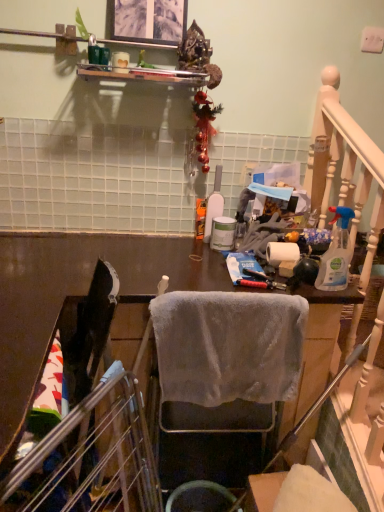
Question: Is clear plastic spray bottle at right, which ranks as the first bottle in right-to-left order, outside of metallic silver picture frame at upper center?

Choices:
 (A) no
 (B) yes

Answer: (B)

Question: From a real-world perspective, does clear plastic spray bottle at right, marked as the second bottle in a back-to-front arrangement, stand above metallic silver picture frame at upper center?

Choices:
 (A) yes
 (B) no

Answer: (B)

Question: Considering the relative sizes of clear plastic spray bottle at right, which ranks as the first bottle in right-to-left order, and metallic silver picture frame at upper center in the image provided, is clear plastic spray bottle at right, which ranks as the first bottle in right-to-left order, bigger than metallic silver picture frame at upper center?

Choices:
 (A) yes
 (B) no

Answer: (B)

Question: From the image's perspective, would you say clear plastic spray bottle at right, which ranks as the first bottle in right-to-left order, is shown under metallic silver picture frame at upper center?

Choices:
 (A) yes
 (B) no

Answer: (A)

Question: Is clear plastic spray bottle at right, marked as the second bottle in a back-to-front arrangement, turned away from metallic silver picture frame at upper center?

Choices:
 (A) yes
 (B) no

Answer: (B)

Question: In terms of width, does metallic gold ornament at upper center look wider or thinner when compared to gray fabric chair at center?

Choices:
 (A) wide
 (B) thin

Answer: (A)

Question: Does point (182, 41) appear closer or farther from the camera than point (243, 309)?

Choices:
 (A) closer
 (B) farther

Answer: (B)

Question: Would you say metallic gold ornament at upper center is to the left or to the right of gray fabric chair at center in the picture?

Choices:
 (A) left
 (B) right

Answer: (A)

Question: From the image's perspective, is metallic gold ornament at upper center above or below gray fabric chair at center?

Choices:
 (A) below
 (B) above

Answer: (B)

Question: Does point (289, 252) appear closer or farther from the camera than point (168, 10)?

Choices:
 (A) closer
 (B) farther

Answer: (A)

Question: From a real-world perspective, relative to metallic silver picture frame at upper center, is white matte toilet paper at center vertically above or below?

Choices:
 (A) below
 (B) above

Answer: (A)

Question: Which is correct: white matte toilet paper at center is inside metallic silver picture frame at upper center, or outside of it?

Choices:
 (A) inside
 (B) outside

Answer: (B)

Question: In terms of size, does white matte toilet paper at center appear bigger or smaller than metallic silver picture frame at upper center?

Choices:
 (A) small
 (B) big

Answer: (A)

Question: In terms of height, does metallic gold ornament at upper center look taller or shorter compared to white matte bottle at center, the 1th bottle positioned from the left?

Choices:
 (A) short
 (B) tall

Answer: (B)

Question: Looking at their shapes, would you say metallic gold ornament at upper center is wider or thinner than white matte bottle at center, acting as the 2th bottle starting from the right?

Choices:
 (A) wide
 (B) thin

Answer: (A)